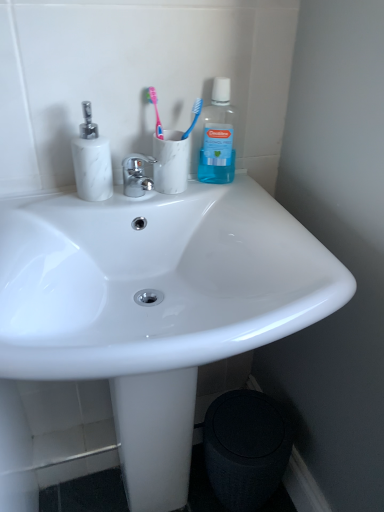
This screenshot has width=384, height=512. In order to click on vacant space positioned to the left of white marble soap dispenser at left in this screenshot , I will do `click(38, 201)`.